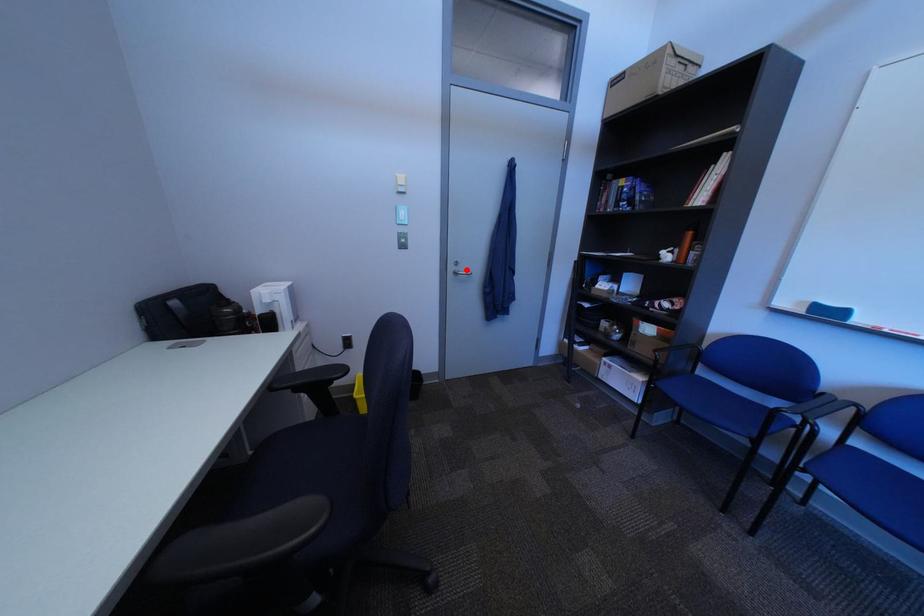
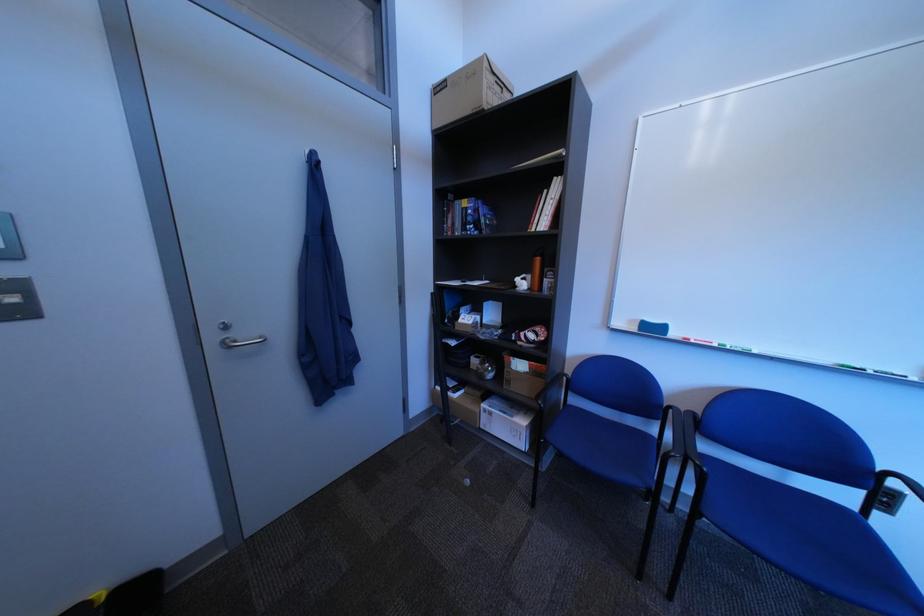
Question: I am providing you with two images of the same scene from different viewpoints. A red point is marked on the first image. Can you still see the location of the red point in image 2?

Choices:
 (A) Yes
 (B) No

Answer: (A)